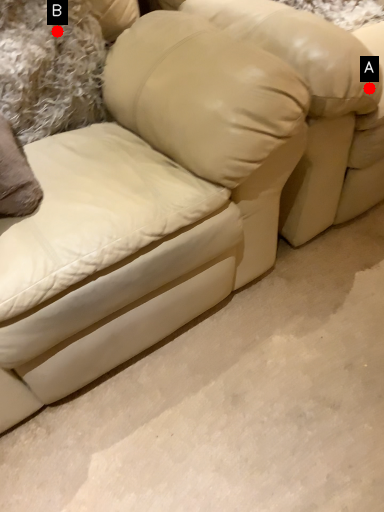
Question: Two points are circled on the image, labeled by A and B beside each circle. Among these points, which one is farthest from the camera?

Choices:
 (A) A is further
 (B) B is further

Answer: (B)